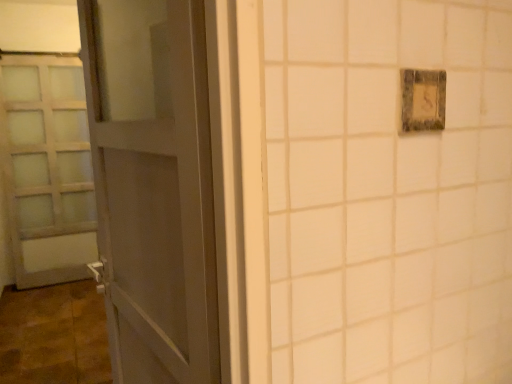
Question: Visually, is rustic wood light switch at upper right positioned to the left or to the right of satin white door at left, the 1th door viewed from the back?

Choices:
 (A) left
 (B) right

Answer: (B)

Question: From their relative heights in the image, would you say rustic wood light switch at upper right is taller or shorter than satin white door at left, the 1th door viewed from the back?

Choices:
 (A) tall
 (B) short

Answer: (B)

Question: Based on their relative distances, which object is nearer to the matte gray door at left, which is the 1th door in right-to-left order?

Choices:
 (A) satin white door at left, the 1th door viewed from the left
 (B) rustic wood light switch at upper right

Answer: (B)

Question: Considering the real-world distances, which object is closest to the rustic wood light switch at upper right?

Choices:
 (A) satin white door at left, the 1th door viewed from the back
 (B) matte gray door at left, the 2th door viewed from the left

Answer: (B)